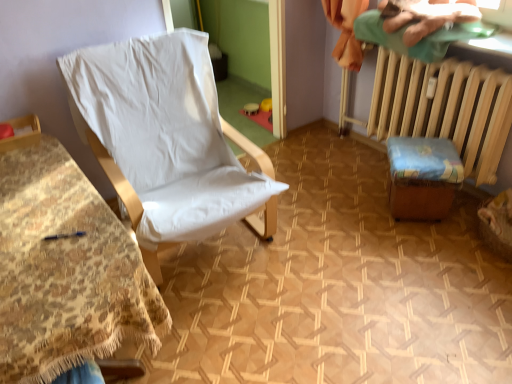
Question: Is green cotton cloth at upper right positioned before white fabric chair at left, the second furniture from the right?

Choices:
 (A) yes
 (B) no

Answer: (B)

Question: Is green cotton cloth at upper right positioned behind white fabric chair at left, the second furniture from the right?

Choices:
 (A) no
 (B) yes

Answer: (B)

Question: Considering the relative sizes of green cotton cloth at upper right and white fabric chair at left, the second furniture from the right, in the image provided, is green cotton cloth at upper right bigger than white fabric chair at left, the second furniture from the right,?

Choices:
 (A) no
 (B) yes

Answer: (A)

Question: Can you confirm if green cotton cloth at upper right is smaller than white fabric chair at left, the second furniture from the right?

Choices:
 (A) yes
 (B) no

Answer: (A)

Question: Is green cotton cloth at upper right next to white fabric chair at left, the second furniture from the right?

Choices:
 (A) no
 (B) yes

Answer: (A)

Question: Considering the positions of wooden radiator at right and wooden stool at lower right, marked as the first furniture in a right-to-left arrangement, in the image, is wooden radiator at right taller or shorter than wooden stool at lower right, marked as the first furniture in a right-to-left arrangement,?

Choices:
 (A) tall
 (B) short

Answer: (A)

Question: Is point (495, 150) closer or farther from the camera than point (399, 172)?

Choices:
 (A) closer
 (B) farther

Answer: (B)

Question: Based on their positions, is wooden radiator at right located to the left or right of wooden stool at lower right, marked as the first furniture in a right-to-left arrangement?

Choices:
 (A) right
 (B) left

Answer: (A)

Question: From a real-world perspective, is wooden radiator at right above or below wooden stool at lower right, the second furniture when ordered from left to right?

Choices:
 (A) above
 (B) below

Answer: (A)

Question: From the image's perspective, is white fabric chair at left, the second furniture from the right, located above or below wooden radiator at right?

Choices:
 (A) above
 (B) below

Answer: (B)

Question: From their relative heights in the image, would you say white fabric chair at left, the first furniture positioned from the left, is taller or shorter than wooden radiator at right?

Choices:
 (A) tall
 (B) short

Answer: (B)

Question: Is white fabric chair at left, the second furniture from the right, spatially inside wooden radiator at right, or outside of it?

Choices:
 (A) outside
 (B) inside

Answer: (A)

Question: Is white fabric chair at left, the second furniture from the right, wider or thinner than wooden radiator at right?

Choices:
 (A) wide
 (B) thin

Answer: (A)

Question: Does point (51, 178) appear closer or farther from the camera than point (441, 23)?

Choices:
 (A) closer
 (B) farther

Answer: (A)

Question: From their relative heights in the image, would you say white fabric chair at left, the second furniture from the right, is taller or shorter than green cotton cloth at upper right?

Choices:
 (A) short
 (B) tall

Answer: (B)